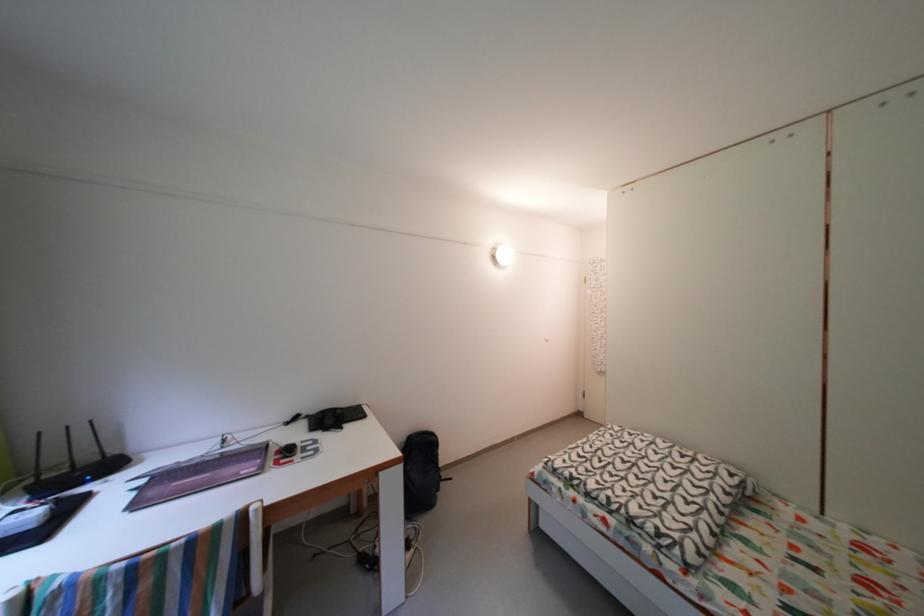
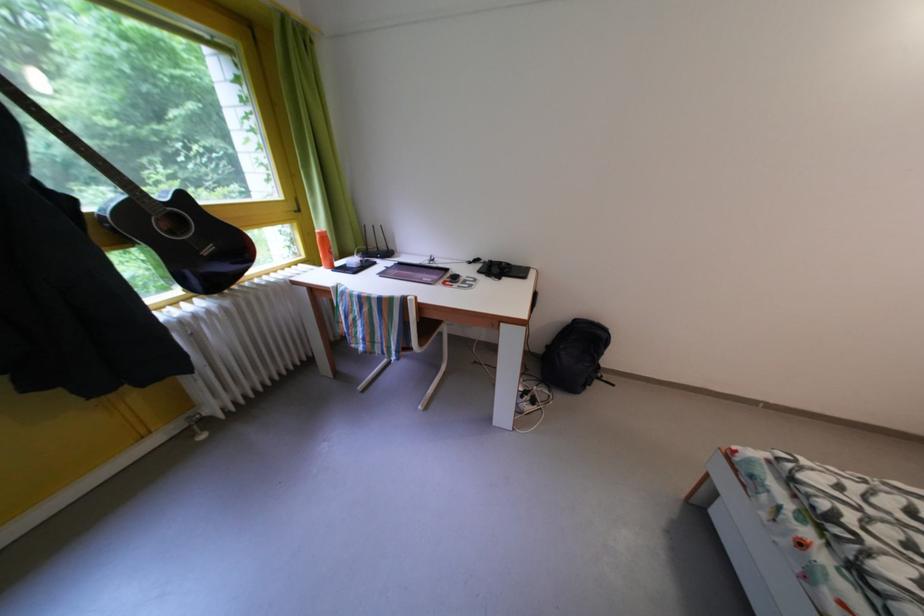
The point at (96, 503) is marked in the first image. Where is the corresponding point in the second image?

(383, 270)